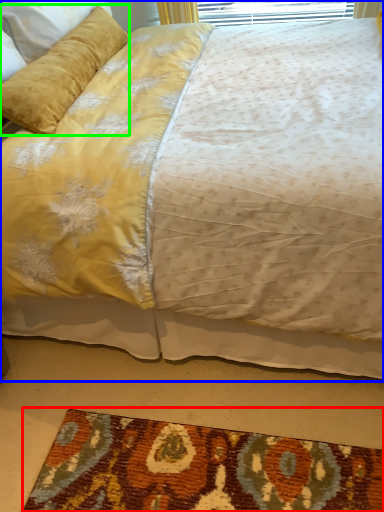
Question: Which object is positioned closest to mat (highlighted by a red box)? Select from bed (highlighted by a blue box) and pillow (highlighted by a green box).

Choices:
 (A) bed
 (B) pillow

Answer: (A)